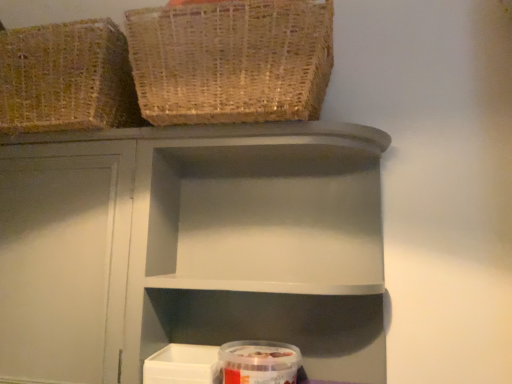
Question: Is transparent plastic container at lower center thinner than woven natural basket at upper left, arranged as the 2th basket when viewed from the left?

Choices:
 (A) yes
 (B) no

Answer: (A)

Question: Does transparent plastic container at lower center touch woven natural basket at upper left, acting as the 1th basket starting from the right?

Choices:
 (A) no
 (B) yes

Answer: (A)

Question: Does transparent plastic container at lower center appear on the right side of woven natural basket at upper left, acting as the 1th basket starting from the right?

Choices:
 (A) yes
 (B) no

Answer: (A)

Question: From a real-world perspective, is transparent plastic container at lower center on top of woven natural basket at upper left, acting as the 1th basket starting from the right?

Choices:
 (A) yes
 (B) no

Answer: (B)

Question: Is transparent plastic container at lower center in front of woven natural basket at upper left, acting as the 1th basket starting from the right?

Choices:
 (A) no
 (B) yes

Answer: (A)

Question: In terms of height, does matte gray shelf at center look taller or shorter compared to woven natural basket at upper left, acting as the 1th basket starting from the right?

Choices:
 (A) short
 (B) tall

Answer: (B)

Question: Is matte gray shelf at center inside the boundaries of woven natural basket at upper left, acting as the 1th basket starting from the right, or outside?

Choices:
 (A) outside
 (B) inside

Answer: (A)

Question: Is point (305, 281) closer or farther from the camera than point (180, 46)?

Choices:
 (A) closer
 (B) farther

Answer: (B)

Question: Based on their positions, is matte gray shelf at center located to the left or right of woven natural basket at upper left, arranged as the 2th basket when viewed from the left?

Choices:
 (A) left
 (B) right

Answer: (B)

Question: Is transparent plastic container at lower center spatially inside woven natural basket at upper left, acting as the 1th basket starting from the right, or outside of it?

Choices:
 (A) inside
 (B) outside

Answer: (B)

Question: Is transparent plastic container at lower center wider or thinner than woven natural basket at upper left, arranged as the 2th basket when viewed from the left?

Choices:
 (A) wide
 (B) thin

Answer: (B)

Question: Considering the relative positions of transparent plastic container at lower center and woven natural basket at upper left, arranged as the 2th basket when viewed from the left, in the image provided, is transparent plastic container at lower center to the left or to the right of woven natural basket at upper left, arranged as the 2th basket when viewed from the left,?

Choices:
 (A) left
 (B) right

Answer: (B)

Question: From a real-world perspective, relative to woven natural basket at upper left, acting as the 1th basket starting from the right, is transparent plastic container at lower center vertically above or below?

Choices:
 (A) below
 (B) above

Answer: (A)

Question: In terms of width, does woven natural basket at upper left, arranged as the 2th basket when viewed from the left, look wider or thinner when compared to transparent plastic container at lower center?

Choices:
 (A) thin
 (B) wide

Answer: (B)

Question: Is point (157, 77) closer or farther from the camera than point (250, 362)?

Choices:
 (A) closer
 (B) farther

Answer: (A)